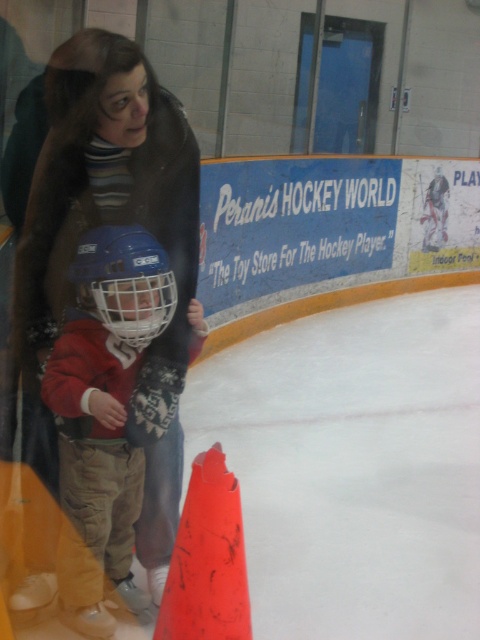
Question: Which object is farther from the camera taking this photo?

Choices:
 (A) matte red helmet at center
 (B) orange matte traffic cone at lower center

Answer: (A)

Question: Which of the following is the closest to the observer?

Choices:
 (A) matte red helmet at center
 (B) orange matte traffic cone at lower center
 (C) matte blue helmet at left

Answer: (B)

Question: Can you confirm if matte red helmet at center is positioned above orange matte traffic cone at lower center?

Choices:
 (A) yes
 (B) no

Answer: (A)

Question: Is the position of matte red helmet at center more distant than that of orange matte traffic cone at lower center?

Choices:
 (A) yes
 (B) no

Answer: (A)

Question: Considering the real-world distances, which object is farthest from the matte red helmet at center?

Choices:
 (A) matte blue helmet at left
 (B) orange matte traffic cone at lower center

Answer: (B)

Question: Is matte red helmet at center bigger than orange matte traffic cone at lower center?

Choices:
 (A) no
 (B) yes

Answer: (B)